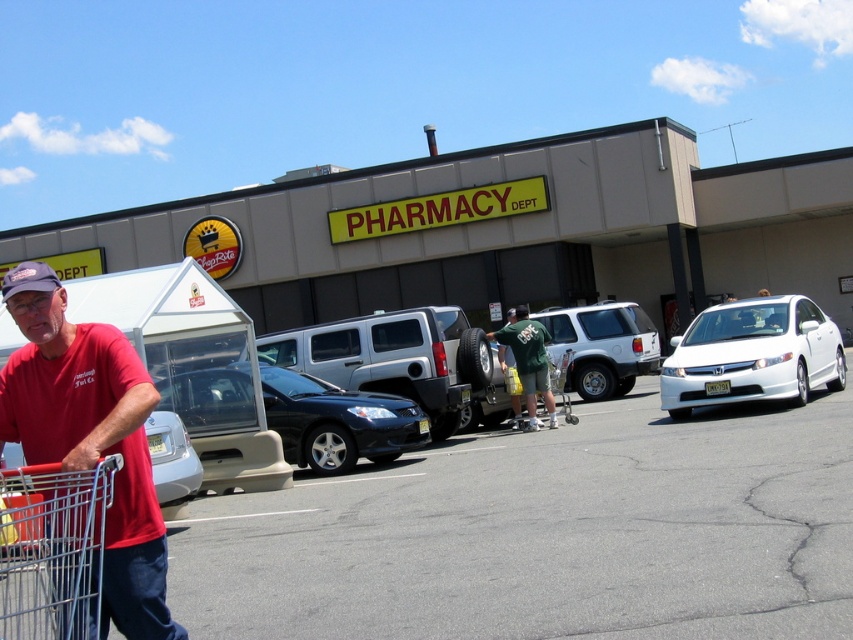
You are standing in front of the ShopRite pharmacy and want to take a photo of the white glossy sedan at right without including the man in the red tshirt and purple cap who is walking towards you. Is the sedan far enough away from the man to frame the shot properly?

The white glossy sedan at right is 38.92 feet away from the camera. Since the man is walking towards the camera, the sedan is sufficiently distant to frame the shot without including him.